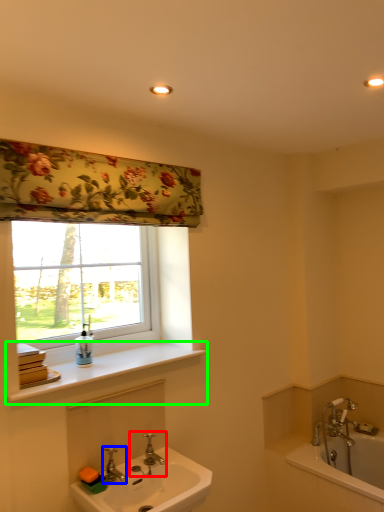
Question: Based on their relative distances, which object is farther from tap (highlighted by a red box)? Choose from tap (highlighted by a blue box) and window sill (highlighted by a green box).

Choices:
 (A) tap
 (B) window sill

Answer: (B)